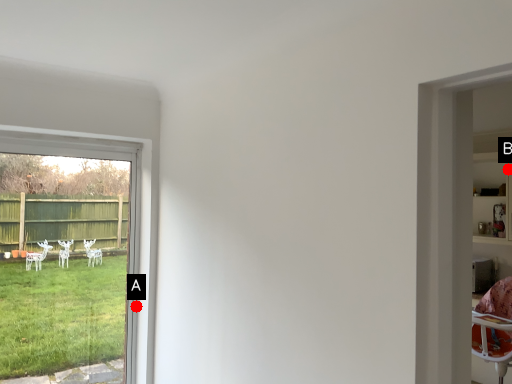
Question: Two points are circled on the image, labeled by A and B beside each circle. Which point is further to the camera?

Choices:
 (A) A is further
 (B) B is further

Answer: (B)